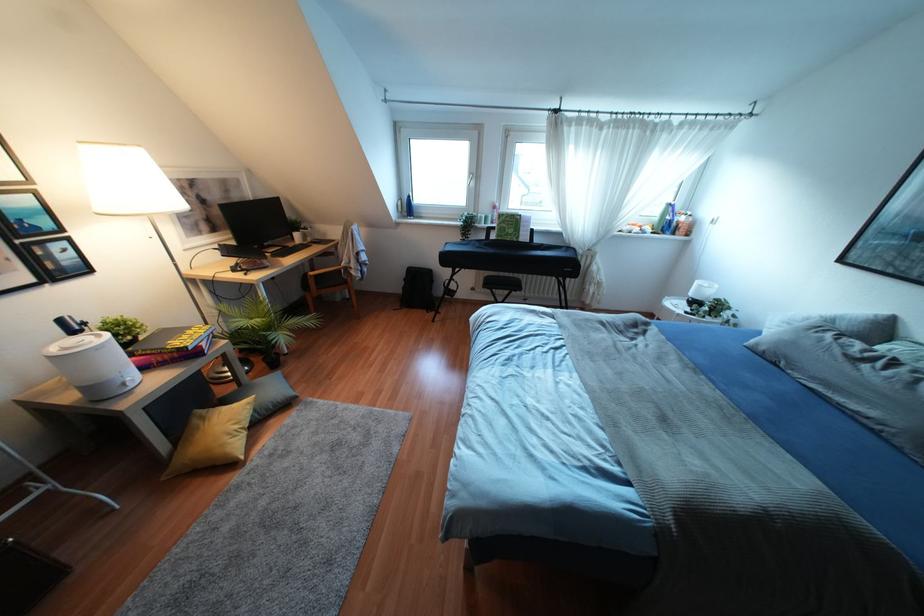
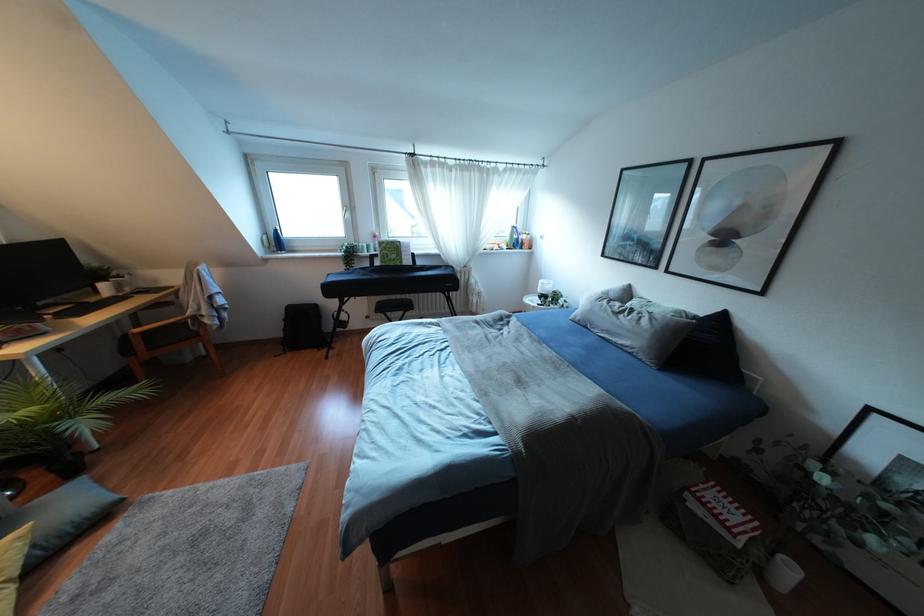
Where in the second image is the point corresponding to point (407, 208) from the first image?

(275, 241)